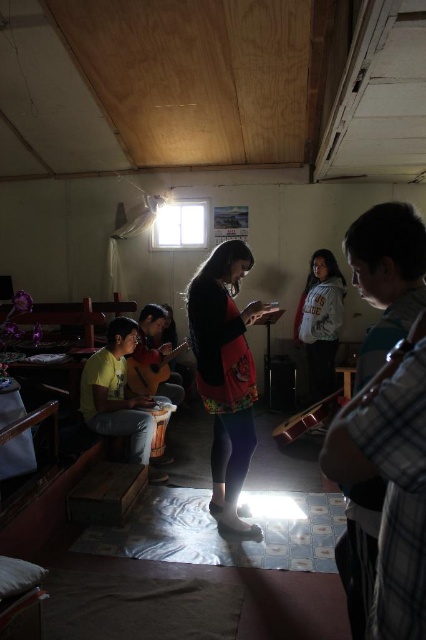
Between point (221, 252) and point (137, 413), which one is positioned behind?

The point (137, 413) is more distant.

Between matte black sweater at center and yellow matte shirt at left, which one is positioned higher?

matte black sweater at center is above.

Is point (242, 445) positioned behind point (115, 352)?

No, it is not.

What are the coordinates of `matte black sweater at center` in the screenshot? It's located at (226, 372).